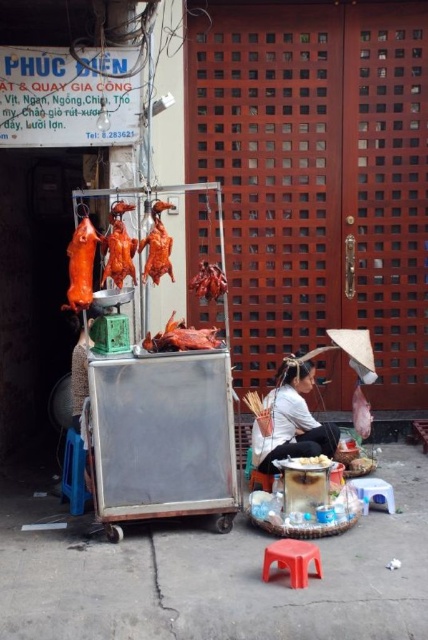
Consider the image. Does smooth plastic stool at lower center appear on the left side of smoked reddish-brown meat at center?

Incorrect, smooth plastic stool at lower center is not on the left side of smoked reddish-brown meat at center.

Which is behind, point (394, 512) or point (222, 275)?

Point (394, 512)

You are a GUI agent. You are given a task and a screenshot of the screen. Output one action in this format:
    pyautogui.click(x=<x>, y=<y>)
    Task: Click on the smooth plastic stool at lower center
    The width and height of the screenshot is (428, 640).
    Given the screenshot: What is the action you would take?
    pyautogui.click(x=374, y=492)

Is shiny brown meat at center shorter than smoked reddish-brown meat at center?

Correct, shiny brown meat at center is not as tall as smoked reddish-brown meat at center.

Does point (145, 348) come closer to viewer compared to point (208, 282)?

No, (145, 348) is further to viewer.

Find the location of `shiny brown meat at center`. shiny brown meat at center is located at coordinates (181, 337).

In the scene shown: Which of these two, matte brown hair at center or red plastic stool at lower center, stands shorter?

Standing shorter between the two is red plastic stool at lower center.

Can you confirm if matte brown hair at center is thinner than red plastic stool at lower center?

In fact, matte brown hair at center might be wider than red plastic stool at lower center.

Does point (303, 381) lie behind point (270, 564)?

That is True.

At what (x,y) coordinates should I click in order to perform the action: click on matte brown hair at center. Please return your answer as a coordinate pair (x, y). The height and width of the screenshot is (640, 428). Looking at the image, I should click on (291, 420).